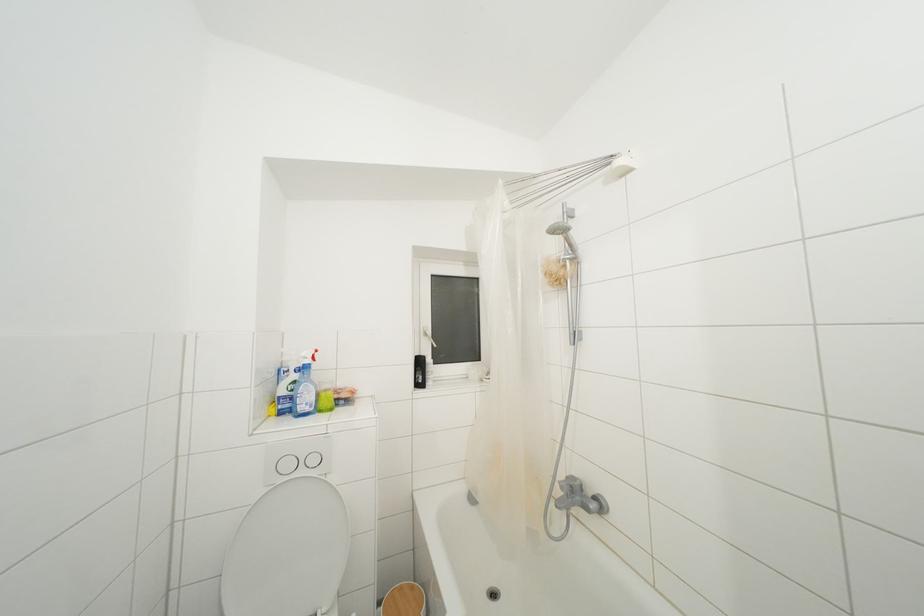
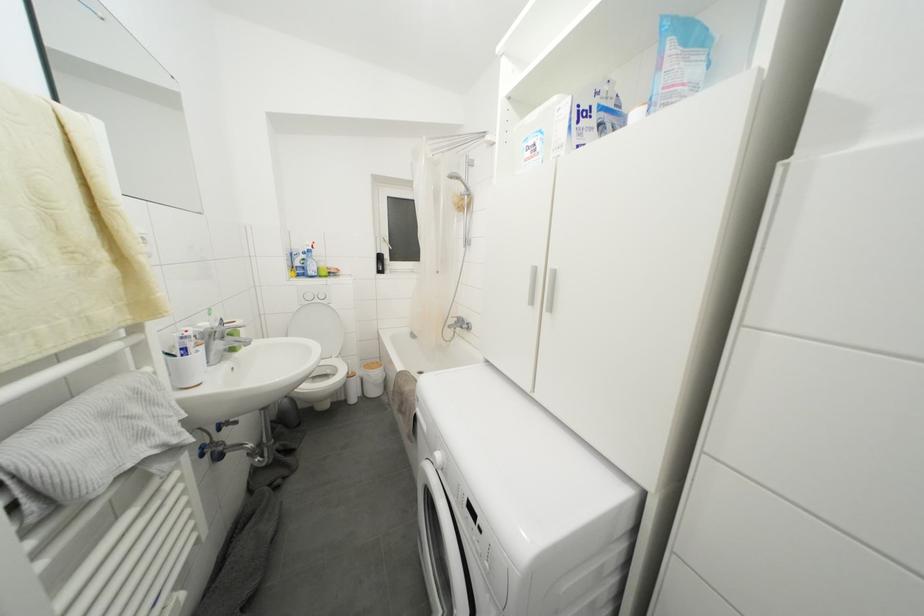
The point at (298, 387) is marked in the first image. Where is the corresponding point in the second image?

(308, 264)